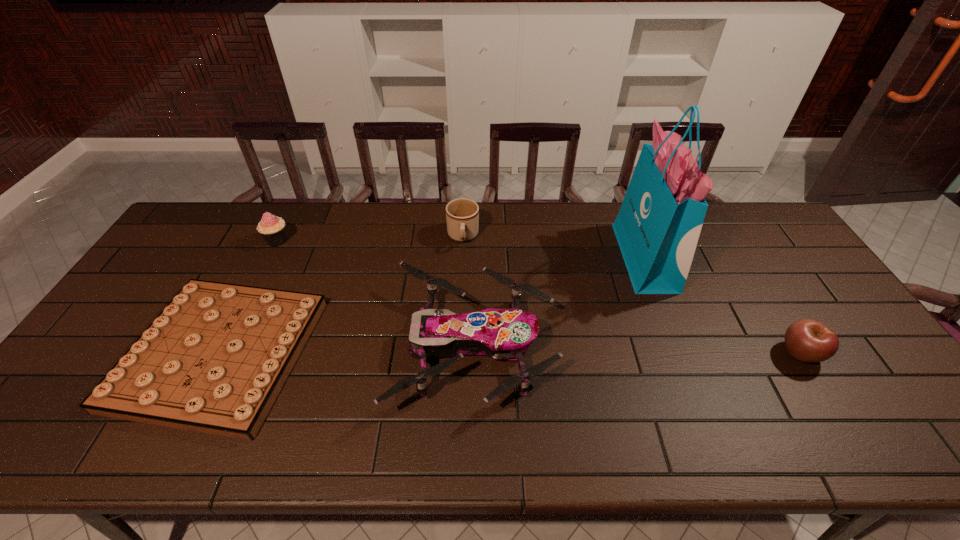
Locate an element on the screen. The width and height of the screenshot is (960, 540). object at the near left corner is located at coordinates (214, 360).

Where is `free space at the far edge of the desktop`? Image resolution: width=960 pixels, height=540 pixels. free space at the far edge of the desktop is located at coordinates (560, 233).

Locate an element on the screen. The height and width of the screenshot is (540, 960). vacant space at the near edge of the desktop is located at coordinates (355, 443).

Identify the location of free point at the left edge. This screenshot has height=540, width=960. (171, 288).

In the image, there is a desktop. Identify the location of vacant space at the far left corner. Image resolution: width=960 pixels, height=540 pixels. (207, 238).

At what (x,y) coordinates should I click in order to perform the action: click on vacant space at the near left corner. Please return your answer as a coordinate pair (x, y). This screenshot has width=960, height=540. Looking at the image, I should click on (16, 453).

Locate an element on the screen. The width and height of the screenshot is (960, 540). blank space at the far right corner of the desktop is located at coordinates (734, 215).

Image resolution: width=960 pixels, height=540 pixels. In order to click on unoccupied area between the apple and the shopping bag in this screenshot , I will do `click(723, 306)`.

In order to click on vacant region between the drone and the mug in this screenshot , I will do `click(468, 292)`.

Locate an element on the screen. Image resolution: width=960 pixels, height=540 pixels. vacant area that lies between the fifth object from left to right and the cupcake is located at coordinates (461, 249).